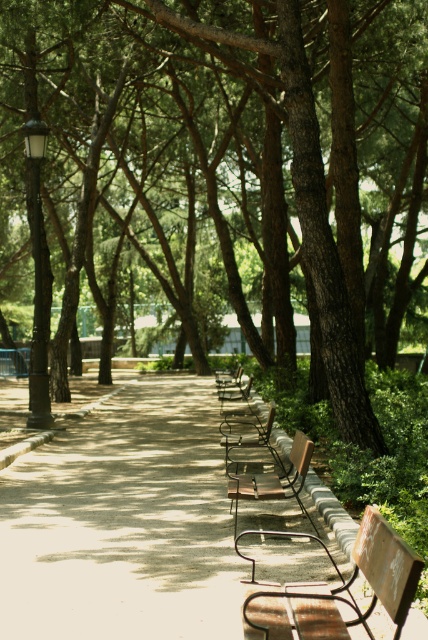
Question: Can you confirm if brown wooden chair at center is positioned above wooden chair at center?

Choices:
 (A) yes
 (B) no

Answer: (B)

Question: In this image, where is brown metal chair at center located relative to metallic brown chair at center?

Choices:
 (A) below
 (B) above

Answer: (A)

Question: Which object is farther from the camera taking this photo?

Choices:
 (A) metallic silver chair at center
 (B) wooden chair at center
 (C) rusty metal bench at center

Answer: (A)

Question: Which object is the closest to the smooth concrete pavement at center?

Choices:
 (A) metallic silver chair at center
 (B) brown textured tree at center

Answer: (A)

Question: In this image, where is brown metal chair at center located relative to brown wooden chair at center?

Choices:
 (A) above
 (B) below

Answer: (B)

Question: Which of the following is the closest to the observer?

Choices:
 (A) (250, 465)
 (B) (247, 460)
 (C) (270, 404)

Answer: (A)